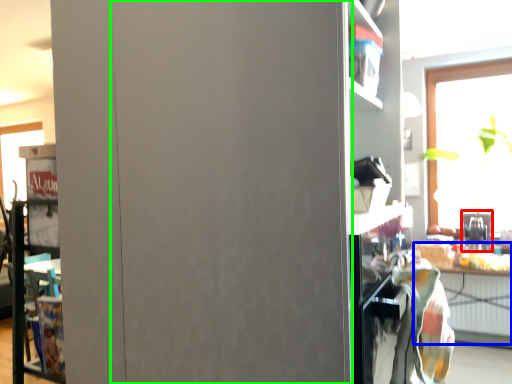
Question: Considering the real-world distances, which object is farthest from appliance (highlighted by a red box)? table (highlighted by a blue box) or garage door (highlighted by a green box)?

Choices:
 (A) table
 (B) garage door

Answer: (B)